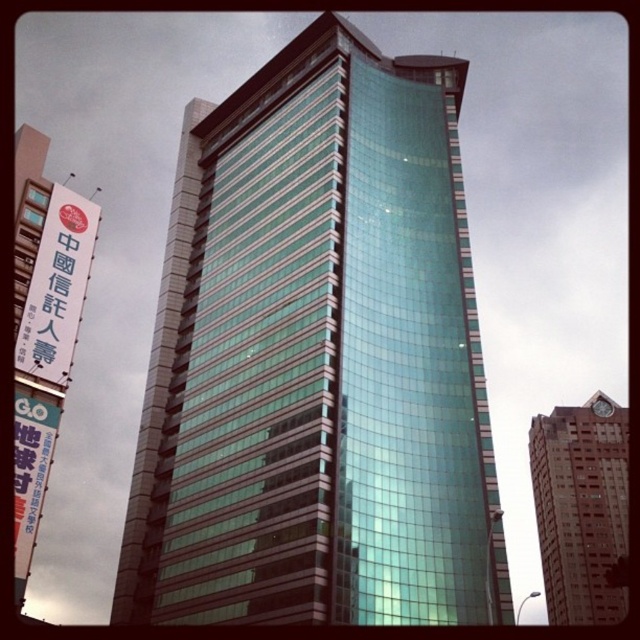
Question: Is green glass building at center smaller than brick textured building at upper right?

Choices:
 (A) no
 (B) yes

Answer: (B)

Question: Which of these objects is positioned farthest from the brick textured building at upper right?

Choices:
 (A) white paper sign at left
 (B) green glass building at center

Answer: (A)

Question: Is green glass building at center further to the viewer compared to brick textured building at upper right?

Choices:
 (A) no
 (B) yes

Answer: (A)

Question: Does brick textured building at upper right have a lesser width compared to white paper sign at left?

Choices:
 (A) yes
 (B) no

Answer: (B)

Question: Which of the following is the farthest from the observer?

Choices:
 (A) brick textured building at upper right
 (B) white paper sign at left

Answer: (A)

Question: Which of the following is the closest to the observer?

Choices:
 (A) green glass building at center
 (B) brick textured building at upper right

Answer: (A)